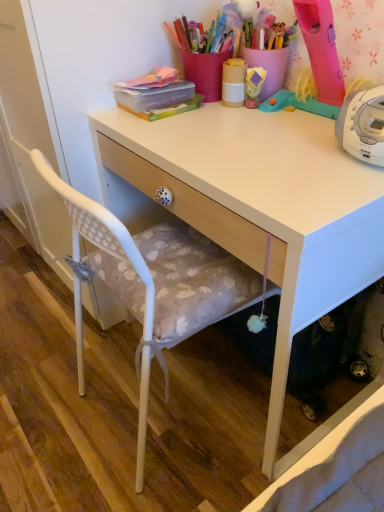
Question: Does white matte desk at center have a lesser width compared to matte yellow cup at upper center?

Choices:
 (A) yes
 (B) no

Answer: (B)

Question: Does white matte desk at center lie in front of matte yellow cup at upper center?

Choices:
 (A) no
 (B) yes

Answer: (B)

Question: From the image's perspective, does white matte desk at center appear higher than matte yellow cup at upper center?

Choices:
 (A) yes
 (B) no

Answer: (B)

Question: Is white matte desk at center not close to matte yellow cup at upper center?

Choices:
 (A) yes
 (B) no

Answer: (B)

Question: Is white matte desk at center beside matte yellow cup at upper center?

Choices:
 (A) no
 (B) yes

Answer: (A)

Question: Is white matte desk at center further to camera compared to matte yellow cup at upper center?

Choices:
 (A) yes
 (B) no

Answer: (B)

Question: Does white plastic chair at left appear on the left side of white matte desk at center?

Choices:
 (A) yes
 (B) no

Answer: (A)

Question: From the image's perspective, would you say white plastic chair at left is positioned over white matte desk at center?

Choices:
 (A) yes
 (B) no

Answer: (B)

Question: From a real-world perspective, is white plastic chair at left physically above white matte desk at center?

Choices:
 (A) no
 (B) yes

Answer: (B)

Question: From the image's perspective, would you say white plastic chair at left is shown under white matte desk at center?

Choices:
 (A) no
 (B) yes

Answer: (B)

Question: Is the surface of white plastic chair at left in direct contact with white matte desk at center?

Choices:
 (A) no
 (B) yes

Answer: (A)

Question: Is white plastic chair at left not inside white matte desk at center?

Choices:
 (A) no
 (B) yes

Answer: (A)

Question: From a real-world perspective, is matte yellow cup at upper center below white matte desk at center?

Choices:
 (A) yes
 (B) no

Answer: (B)